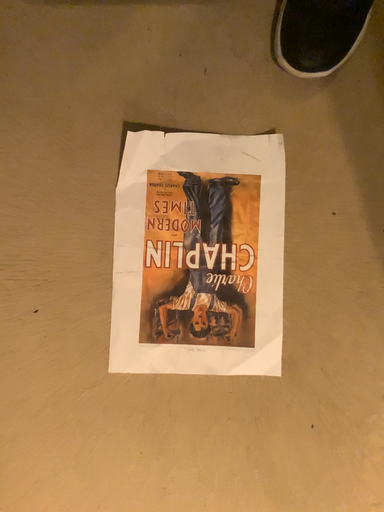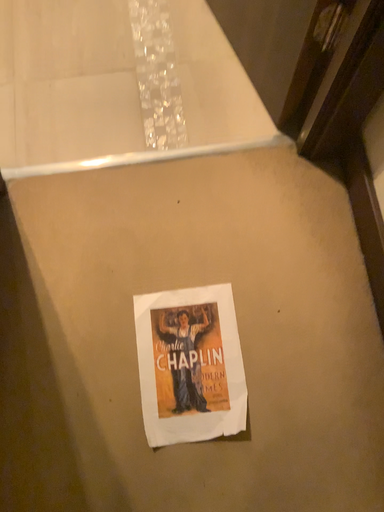
Question: Which way did the camera rotate in the video?

Choices:
 (A) rotated upward
 (B) rotated downward

Answer: (A)